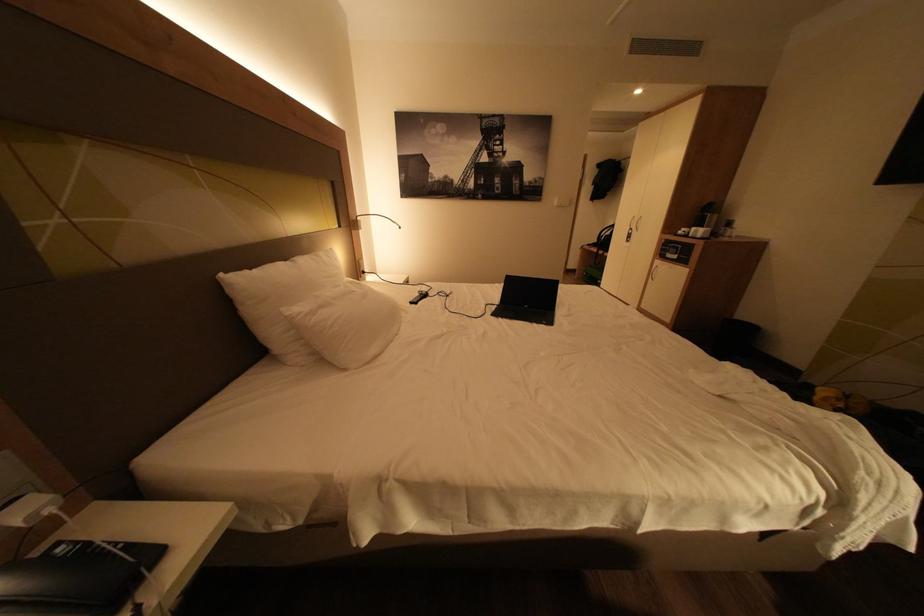
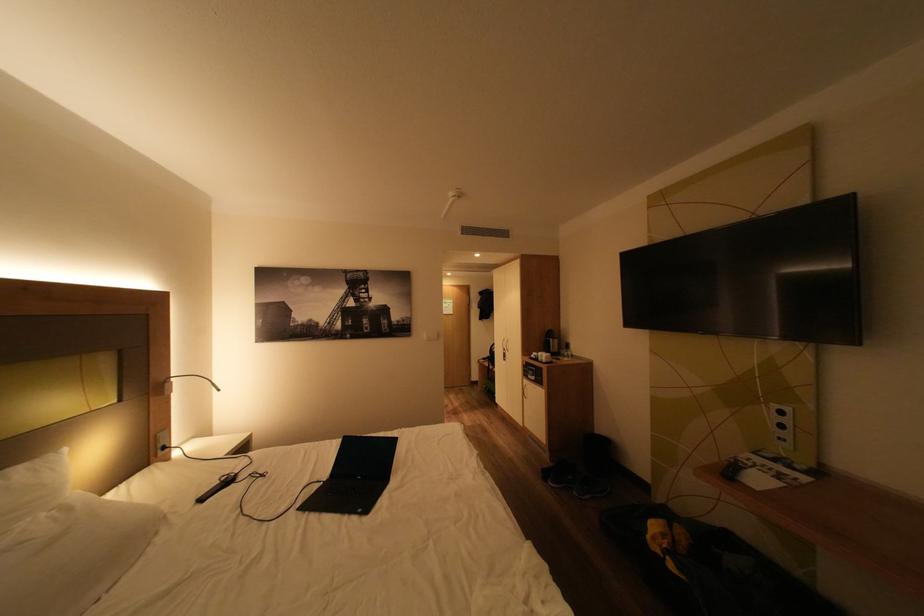
Where in the second image is the point corresponding to the point at 704,229 from the first image?

(551, 354)